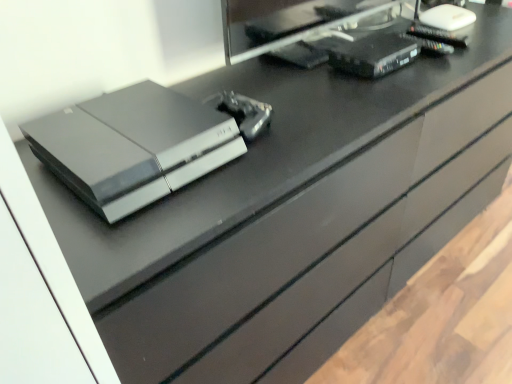
Locate an element on the screen. vacant area that is situated to the right of metallic silver controller at center, which is the 1th equipment in bottom-to-top order is located at coordinates (321, 114).